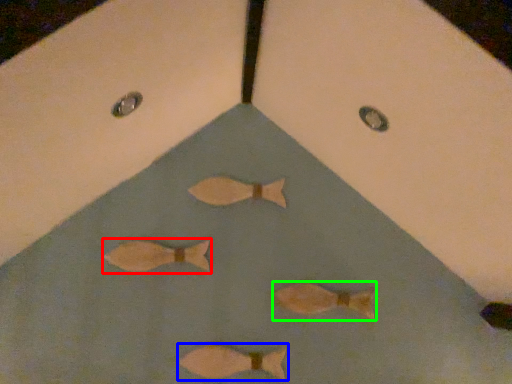
Question: Which object is positioned closest to fish (highlighted by a red box)? Select from fish (highlighted by a blue box) and fish (highlighted by a green box).

Choices:
 (A) fish
 (B) fish

Answer: (A)